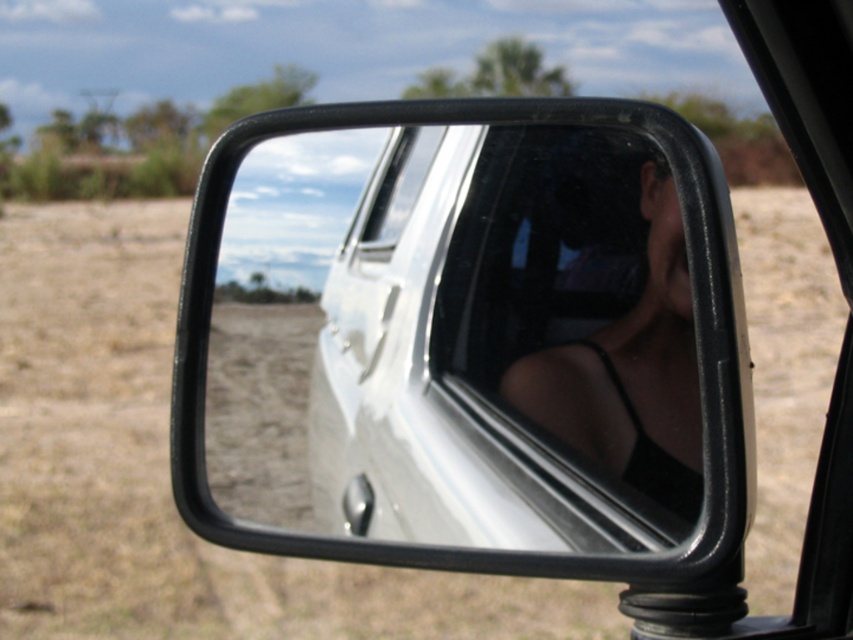
Is black glossy mirror at center further to camera compared to clear glass window at center?

No, it is not.

Describe the element at coordinates (469, 346) in the screenshot. I see `black glossy mirror at center` at that location.

The image size is (853, 640). Find the location of `black glossy mirror at center`. black glossy mirror at center is located at coordinates (469, 346).

Between black glossy mirror at center and transparent glass car window at center, which one is positioned higher?

black glossy mirror at center is higher up.

Who is more forward, (740, 561) or (666, 432)?

Point (666, 432) is more forward.

Does point (337, 358) lie behind point (602, 129)?

That is True.

Find the location of a particular element. black glossy mirror at center is located at coordinates (469, 346).

In the scene shown: Who is lower down, transparent glass car window at center or clear glass window at center?

Positioned lower is transparent glass car window at center.

Is point (698, 504) less distant than point (373, 236)?

Yes, point (698, 504) is closer to viewer.

Locate an element on the screen. transparent glass car window at center is located at coordinates (577, 317).